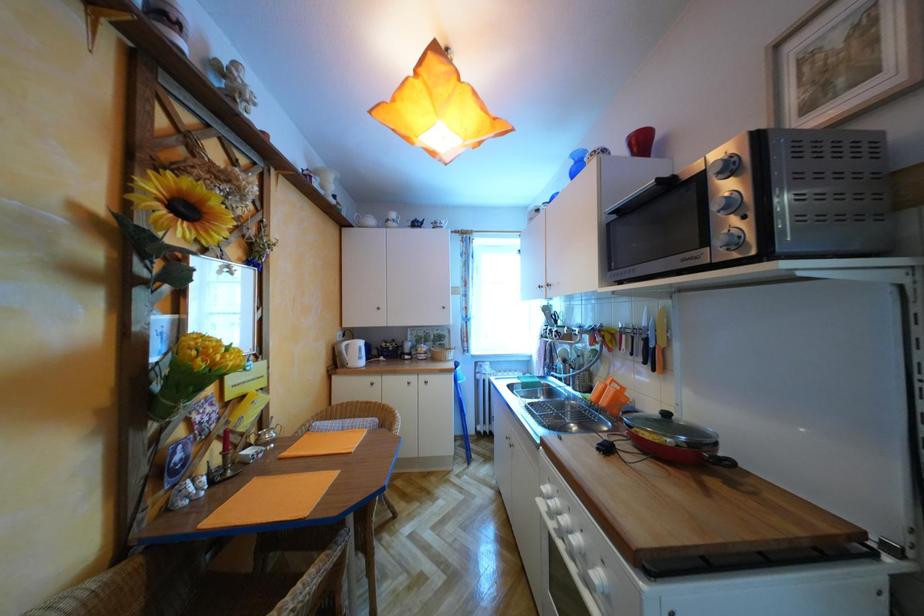
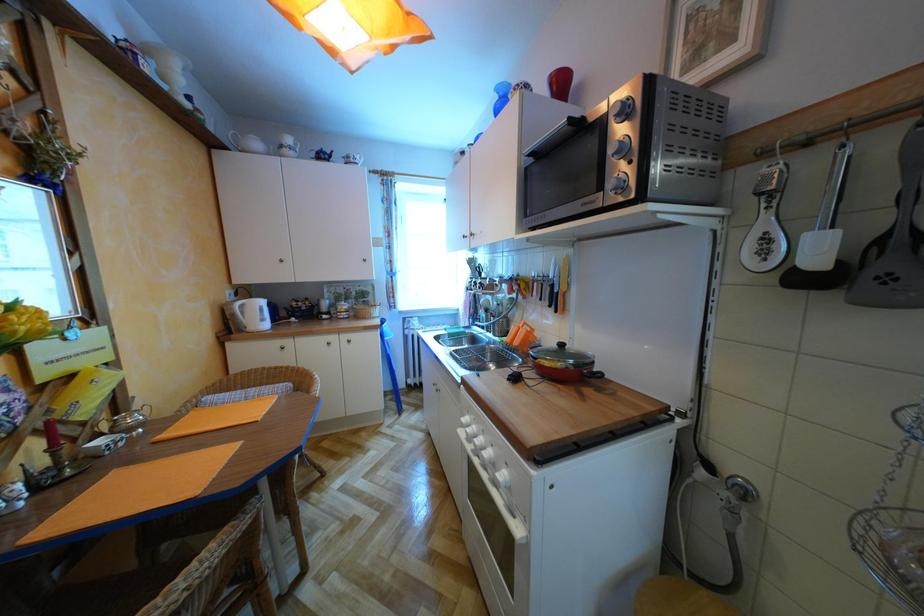
What movement of the cameraman would produce the second image?

The movement direction of the cameraman is right, forward.